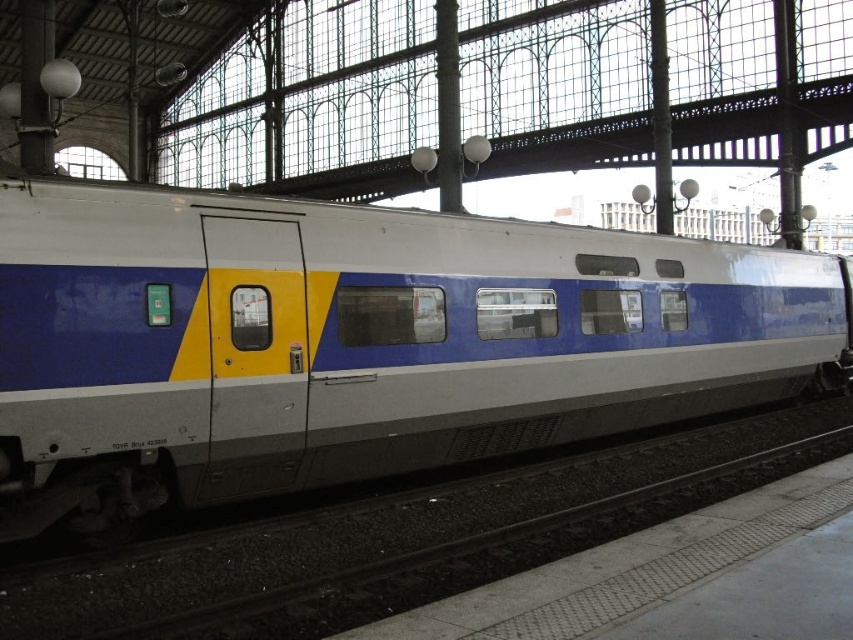
Question: Which of the following is the farthest from the observer?

Choices:
 (A) matte white train at center
 (B) metallic gray track at lower center

Answer: (A)

Question: Is matte white train at center smaller than metallic gray track at lower center?

Choices:
 (A) no
 (B) yes

Answer: (A)

Question: From the image, what is the correct spatial relationship of matte white train at center in relation to metallic gray track at lower center?

Choices:
 (A) above
 (B) below

Answer: (A)

Question: Does matte white train at center appear over metallic gray track at lower center?

Choices:
 (A) no
 (B) yes

Answer: (B)